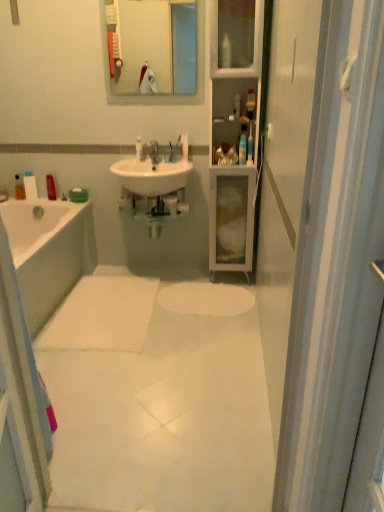
Question: In terms of width, does white matte soap bar at left, the 3th toiletry viewed from the back, look wider or thinner when compared to translucent plastic bottle at upper center, the sixth toiletry viewed from the left?

Choices:
 (A) thin
 (B) wide

Answer: (A)

Question: From the image's perspective, is white matte soap bar at left, which is the 2th toiletry in left-to-right order, above or below translucent plastic bottle at upper center, the sixth toiletry viewed from the left?

Choices:
 (A) above
 (B) below

Answer: (B)

Question: Estimate the real-world distances between objects in this image. Which object is closer to the white glossy tap at center?

Choices:
 (A) translucent plastic bottle at upper center, the second toiletry viewed from the right
 (B) white matte soap bar at left, the 3th toiletry viewed from the back
 (C) clear glass mirror at upper center
 (D) translucent plastic bottle at upper center, positioned as the 1th toiletry in front-to-back order
 (E) white glossy sink at center

Answer: (E)

Question: Based on their relative distances, which object is farther from the white plastic toothbrush at upper center, the third toiletry viewed from the front?

Choices:
 (A) translucent plastic bottle at upper center, positioned as the fifth toiletry in left-to-right order
 (B) white smooth mat at center
 (C) white glossy sink at center
 (D) translucent plastic bottle at left, which ranks as the sixth toiletry in right-to-left order
 (E) translucent plastic bottle at upper center, which ranks as the 6th toiletry in back-to-front order

Answer: (B)